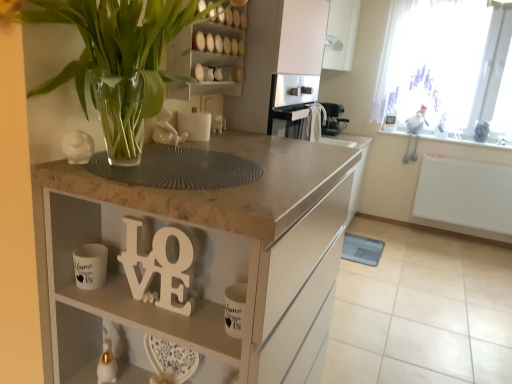
Question: From the image's perspective, is white glossy mug at lower left located beneath wooden shelves at upper center?

Choices:
 (A) no
 (B) yes

Answer: (B)

Question: Does white glossy mug at lower left turn towards wooden shelves at upper center?

Choices:
 (A) no
 (B) yes

Answer: (A)

Question: Can you confirm if white glossy mug at lower left is positioned to the left of wooden shelves at upper center?

Choices:
 (A) no
 (B) yes

Answer: (B)

Question: Considering the relative sizes of white glossy mug at lower left and wooden shelves at upper center in the image provided, is white glossy mug at lower left thinner than wooden shelves at upper center?

Choices:
 (A) no
 (B) yes

Answer: (A)

Question: Would you say wooden shelves at upper center is part of white glossy mug at lower left's contents?

Choices:
 (A) no
 (B) yes

Answer: (A)

Question: Considering the positions of wooden shelves at upper center and white matte wooden letters at center in the image, is wooden shelves at upper center wider or thinner than white matte wooden letters at center?

Choices:
 (A) wide
 (B) thin

Answer: (A)

Question: From a real-world perspective, is wooden shelves at upper center above or below white matte wooden letters at center?

Choices:
 (A) below
 (B) above

Answer: (B)

Question: Is point (225, 57) positioned closer to the camera than point (193, 256)?

Choices:
 (A) farther
 (B) closer

Answer: (A)

Question: From the image's perspective, is wooden shelves at upper center above or below white matte wooden letters at center?

Choices:
 (A) above
 (B) below

Answer: (A)

Question: Is black plastic coffee machine at upper right inside the boundaries of matte stone countertop at center, or outside?

Choices:
 (A) inside
 (B) outside

Answer: (B)

Question: From the image's perspective, is black plastic coffee machine at upper right located above or below matte stone countertop at center?

Choices:
 (A) above
 (B) below

Answer: (A)

Question: Visually, is black plastic coffee machine at upper right positioned to the left or to the right of matte stone countertop at center?

Choices:
 (A) left
 (B) right

Answer: (B)

Question: Considering the positions of black plastic coffee machine at upper right and matte stone countertop at center in the image, is black plastic coffee machine at upper right taller or shorter than matte stone countertop at center?

Choices:
 (A) short
 (B) tall

Answer: (A)

Question: Is white matte cabinet at upper center situated inside black plastic coffee machine at upper right or outside?

Choices:
 (A) outside
 (B) inside

Answer: (A)

Question: Considering their positions, is white matte cabinet at upper center located in front of or behind black plastic coffee machine at upper right?

Choices:
 (A) front
 (B) behind

Answer: (A)